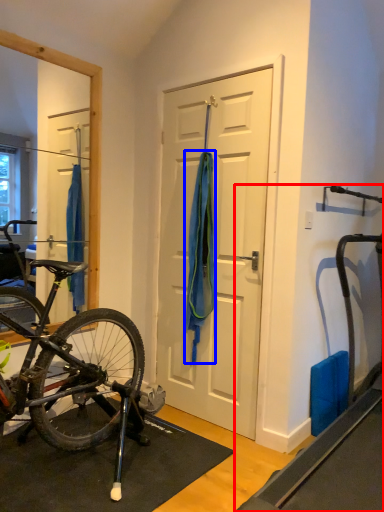
Question: Which point is closer to the camera, treadmill (highlighted by a red box) or towel/napkin (highlighted by a blue box)?

Choices:
 (A) treadmill
 (B) towel/napkin

Answer: (A)